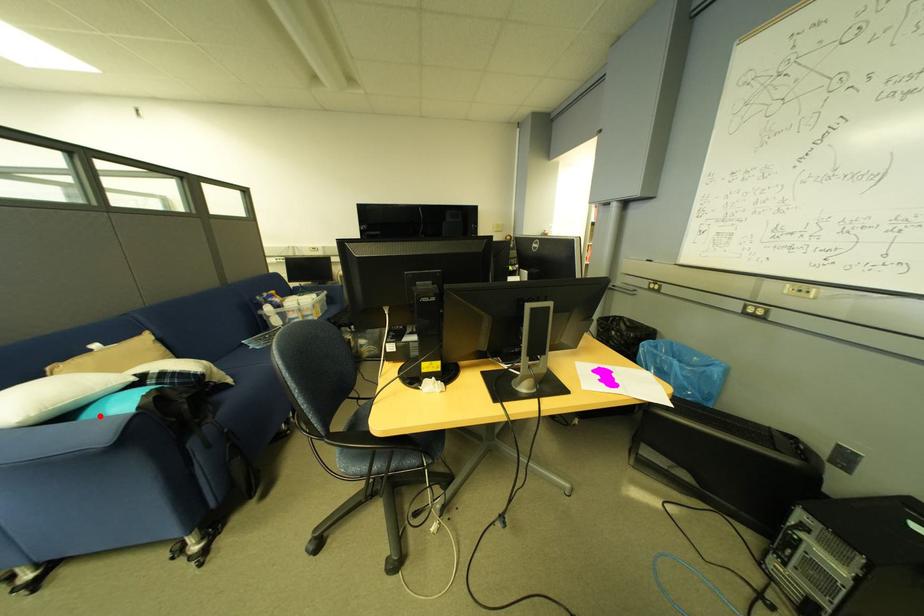
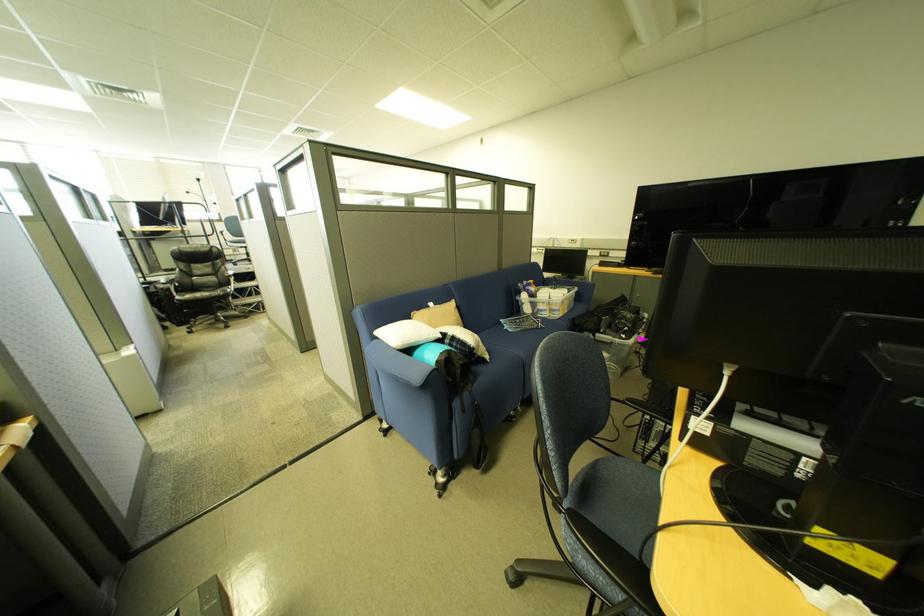
Where in the second image is the point corresponding to the highlighted location from the first image?

(429, 355)